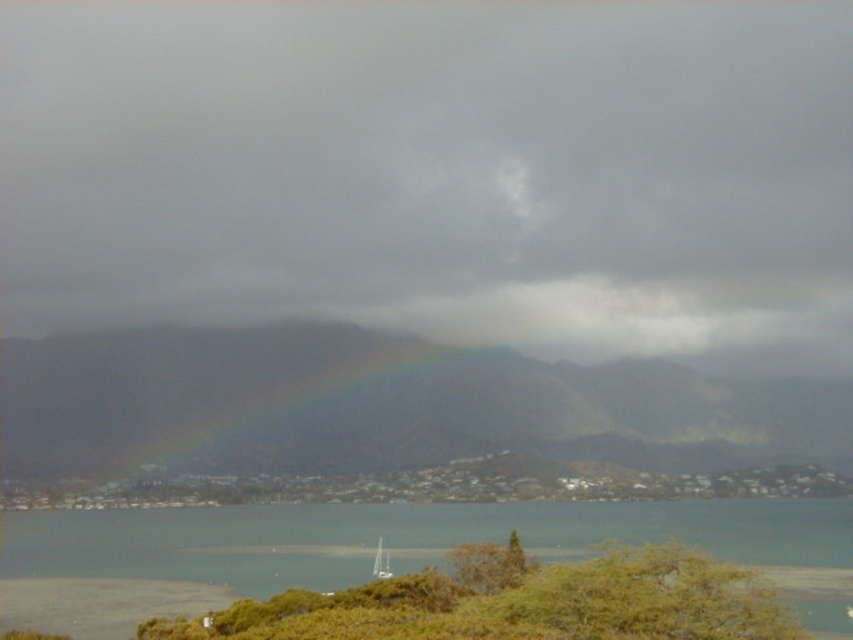
Question: Which point is closer to the camera?

Choices:
 (A) white sailboat at center
 (B) clear water at lower center

Answer: (B)

Question: Is rainbow at center bigger than white sailboat at center?

Choices:
 (A) yes
 (B) no

Answer: (A)

Question: Is clear water at lower center above white sailboat at center?

Choices:
 (A) no
 (B) yes

Answer: (B)

Question: Which point is closer to the camera taking this photo?

Choices:
 (A) (833, 321)
 (B) (560, 522)
 (C) (375, 573)

Answer: (C)

Question: Does clear water at lower center have a smaller size compared to white sailboat at center?

Choices:
 (A) no
 (B) yes

Answer: (A)

Question: Which object is the closest to the clear water at lower center?

Choices:
 (A) white sailboat at center
 (B) rainbow at center

Answer: (A)